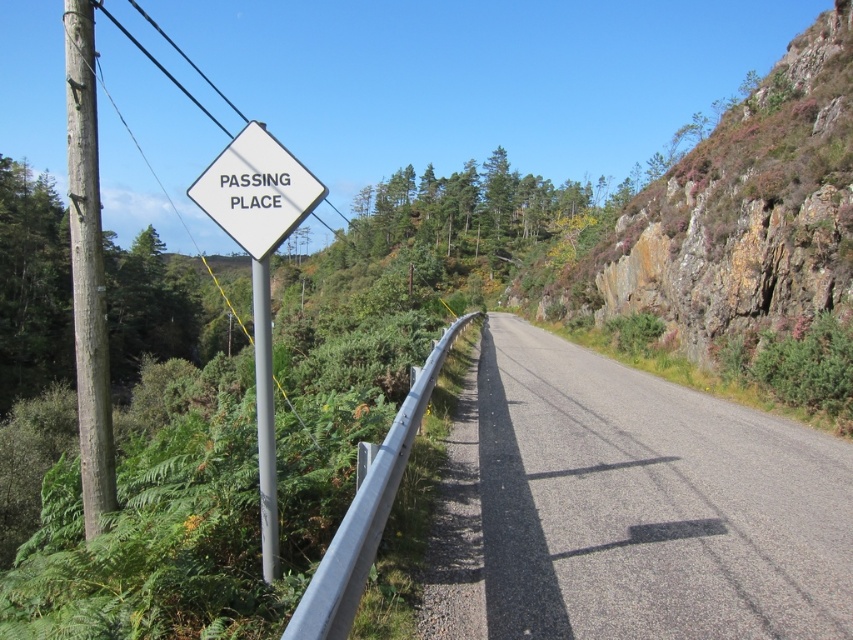
Question: Can you confirm if rocky cliff at right is wider than silver metallic rail at center?

Choices:
 (A) no
 (B) yes

Answer: (B)

Question: Is the position of white plastic sign at center-left more distant than that of white plastic diamond-shaped sign at upper center?

Choices:
 (A) yes
 (B) no

Answer: (B)

Question: Does white plastic sign at center-left appear over silver metallic rail at center?

Choices:
 (A) yes
 (B) no

Answer: (A)

Question: Estimate the real-world distances between objects in this image. Which object is farther from the smooth wooden pole at left?

Choices:
 (A) silver metallic pole at left
 (B) silver metallic rail at center
 (C) white plastic sign at center-left

Answer: (B)

Question: Which object appears closest to the camera in this image?

Choices:
 (A) silver metallic pole at left
 (B) white plastic diamond-shaped sign at upper center

Answer: (A)

Question: Which of the following is the closest to the observer?

Choices:
 (A) (254, 232)
 (B) (769, 113)

Answer: (A)